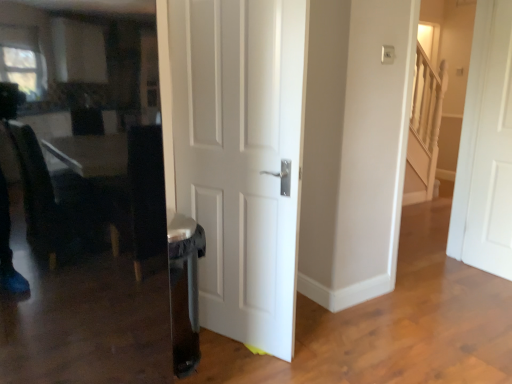
Question: Based on their positions, is white matte door at right, which ranks as the second door in left-to-right order, located to the left or right of white matte door at center, the second door in the right-to-left sequence?

Choices:
 (A) left
 (B) right

Answer: (B)

Question: Is white matte door at right, the 2th door in the front-to-back sequence, spatially inside white matte door at center, positioned as the first door in left-to-right order, or outside of it?

Choices:
 (A) outside
 (B) inside

Answer: (A)

Question: From the image's perspective, relative to white matte door at center, positioned as the first door in left-to-right order, is white matte door at right, placed as the first door when sorted from right to left, above or below?

Choices:
 (A) below
 (B) above

Answer: (B)

Question: Considering the relative positions of white matte door at center, positioned as the first door in left-to-right order, and white matte door at right, the 2th door in the front-to-back sequence, in the image provided, is white matte door at center, positioned as the first door in left-to-right order, to the left or to the right of white matte door at right, the 2th door in the front-to-back sequence,?

Choices:
 (A) left
 (B) right

Answer: (A)

Question: Is white matte door at center, the second door in the right-to-left sequence, situated inside white matte door at right, the 2th door in the front-to-back sequence, or outside?

Choices:
 (A) inside
 (B) outside

Answer: (B)

Question: From the image's perspective, is white matte door at center, the second door in the right-to-left sequence, above or below white matte door at right, placed as the first door when sorted from right to left?

Choices:
 (A) above
 (B) below

Answer: (B)

Question: In terms of size, does white matte door at center, positioned as the first door in left-to-right order, appear bigger or smaller than white matte door at right, the first door in the back-to-front sequence?

Choices:
 (A) big
 (B) small

Answer: (A)